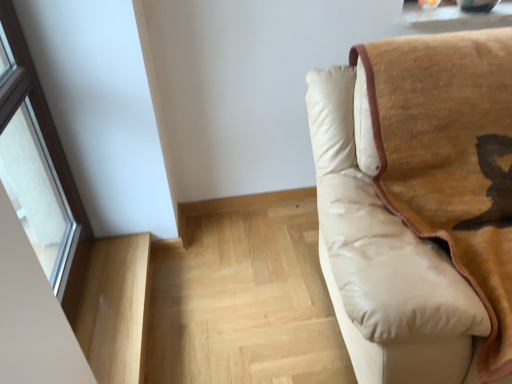
What are the coordinates of `free point above light wood stairwell at lower left, the 2th stairwell viewed from the right (from a real-world perspective)` in the screenshot? It's located at (108, 295).